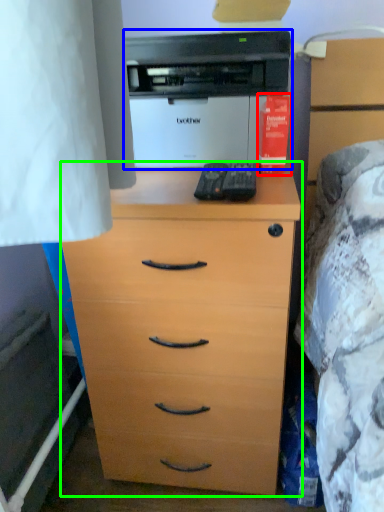
Question: Which object is the closest to the book (highlighted by a red box)? Choose among these: printer (highlighted by a blue box) or chest of drawers (highlighted by a green box).

Choices:
 (A) printer
 (B) chest of drawers

Answer: (A)